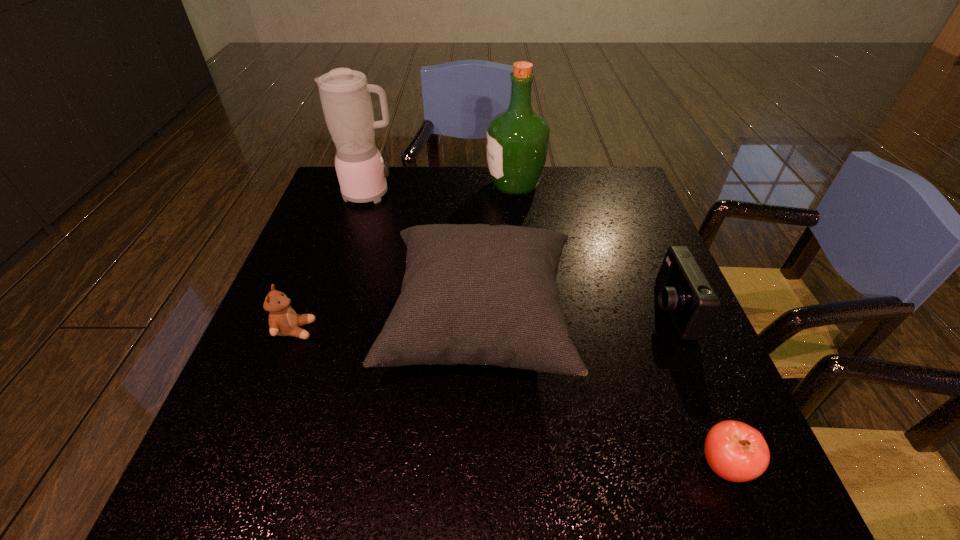
Where is `liquor`? liquor is located at coordinates (517, 139).

Identify the location of food processor. This screenshot has width=960, height=540. (345, 96).

Identify the location of the third tallest object. The height and width of the screenshot is (540, 960). (476, 294).

Where is `camera`? The image size is (960, 540). camera is located at coordinates (684, 291).

In order to click on teddy bear in this screenshot , I will do `click(283, 321)`.

The width and height of the screenshot is (960, 540). I want to click on the nearest object, so click(735, 451).

You are a GUI agent. You are given a task and a screenshot of the screen. Output one action in this format:
    pyautogui.click(x=<x>, y=<y>)
    Task: Click on the vacant space situated 0.360m on the front-facing side of the liquor
    The image size is (960, 540).
    Given the screenshot: What is the action you would take?
    pyautogui.click(x=369, y=185)

Locate an element on the screen. vacant position located on the front-facing side of the liquor is located at coordinates (372, 185).

Find the location of a particular element. free space located 0.100m on the front-facing side of the liquor is located at coordinates (453, 185).

Identify the location of vacant region located 0.290m on the base of the food processor near the control knob. This screenshot has width=960, height=540. (497, 194).